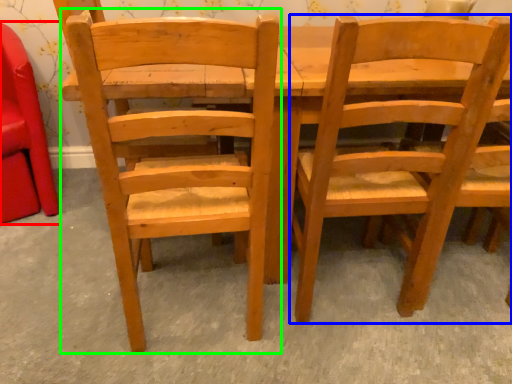
Question: Estimate the real-world distances between objects in this image. Which object is closer to chair (highlighted by a red box), chair (highlighted by a blue box) or chair (highlighted by a green box)?

Choices:
 (A) chair
 (B) chair

Answer: (B)